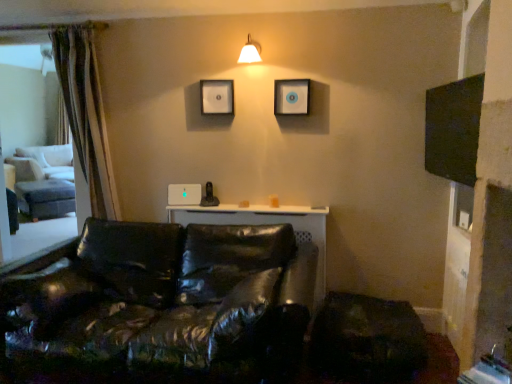
Question: Choose the correct answer: Is black matte screen at upper right inside matte black picture frame at upper center, the 2th picture frame positioned from the right, or outside it?

Choices:
 (A) outside
 (B) inside

Answer: (A)

Question: In terms of width, does black matte screen at upper right look wider or thinner when compared to matte black picture frame at upper center, the 2th picture frame positioned from the right?

Choices:
 (A) wide
 (B) thin

Answer: (A)

Question: Estimate the real-world distances between objects in this image. Which object is closer to the matte black picture frame at upper center, placed as the second picture frame when sorted from left to right?

Choices:
 (A) white glossy wall lamp at upper center
 (B) brown textured curtain at left
 (C) black leather couch at lower left
 (D) black matte screen at upper right
 (E) matte black picture frame at upper center, arranged as the 1th picture frame when viewed from the left

Answer: (A)

Question: Which object is the farthest from the white glossy wall lamp at upper center?

Choices:
 (A) black matte screen at upper right
 (B) matte black picture frame at upper center, which is the 1th picture frame in right-to-left order
 (C) matte black picture frame at upper center, arranged as the 1th picture frame when viewed from the left
 (D) brown textured curtain at left
 (E) black leather couch at lower left

Answer: (E)